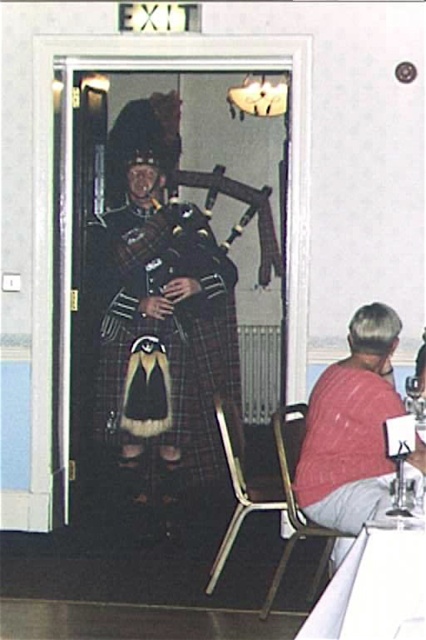
Which is above, metallic gold chair at lower center or polished wood bagpipes at center?

Positioned higher is polished wood bagpipes at center.

Measure the distance between point (281, 438) and camera.

Point (281, 438) is 12.92 feet from camera.

Locate an element on the screen. The width and height of the screenshot is (426, 640). metallic gold chair at lower center is located at coordinates (296, 502).

Is point (359, 362) closer to viewer compared to point (268, 273)?

That is True.

Who is taller, red knit sweater at lower right or polished wood bagpipes at center?

With more height is polished wood bagpipes at center.

Locate an element on the screen. The height and width of the screenshot is (640, 426). red knit sweater at lower right is located at coordinates (351, 428).

Which is behind, point (236, 534) or point (270, 273)?

The point (270, 273) is more distant.

Does metallic gold chair at lower right have a lesser width compared to polished wood bagpipes at center?

Yes.

Is point (224, 445) farther from viewer compared to point (173, 177)?

No, (224, 445) is closer to viewer.

Identify the location of metallic gold chair at lower right. (241, 484).